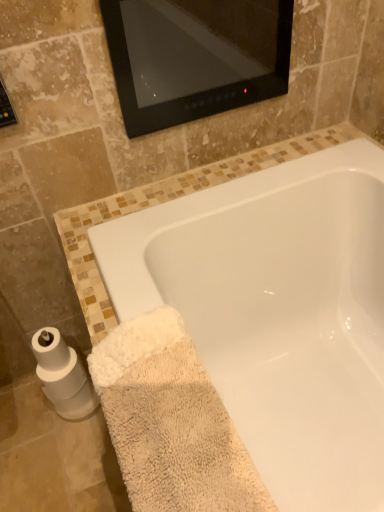
Question: Is the depth of white glossy bathtub at lower center less than that of white matte toilet paper at lower left?

Choices:
 (A) no
 (B) yes

Answer: (B)

Question: Does white glossy bathtub at lower center have a greater height compared to white matte toilet paper at lower left?

Choices:
 (A) no
 (B) yes

Answer: (B)

Question: Can you confirm if white glossy bathtub at lower center is bigger than white matte toilet paper at lower left?

Choices:
 (A) no
 (B) yes

Answer: (B)

Question: Does white glossy bathtub at lower center have a smaller size compared to white matte toilet paper at lower left?

Choices:
 (A) yes
 (B) no

Answer: (B)

Question: Is white glossy bathtub at lower center wider than white matte toilet paper at lower left?

Choices:
 (A) yes
 (B) no

Answer: (A)

Question: Considering the relative positions of white glossy bathtub at lower center and white matte toilet paper at lower left in the image provided, is white glossy bathtub at lower center to the right of white matte toilet paper at lower left from the viewer's perspective?

Choices:
 (A) no
 (B) yes

Answer: (B)

Question: Can you confirm if white matte toilet paper at lower left is smaller than white glossy bathtub at lower center?

Choices:
 (A) yes
 (B) no

Answer: (A)

Question: Is white matte toilet paper at lower left wider than white glossy bathtub at lower center?

Choices:
 (A) no
 (B) yes

Answer: (A)

Question: Does white matte toilet paper at lower left appear on the right side of white glossy bathtub at lower center?

Choices:
 (A) no
 (B) yes

Answer: (A)

Question: From a real-world perspective, does white matte toilet paper at lower left sit lower than white glossy bathtub at lower center?

Choices:
 (A) yes
 (B) no

Answer: (A)

Question: Can white glossy bathtub at lower center be found inside white matte toilet paper at lower left?

Choices:
 (A) yes
 (B) no

Answer: (B)

Question: Could you tell me if white matte toilet paper at lower left is turned towards white glossy bathtub at lower center?

Choices:
 (A) no
 (B) yes

Answer: (A)

Question: Does white matte toilet paper at lower left lie behind beige fluffy towel at lower left?

Choices:
 (A) no
 (B) yes

Answer: (B)